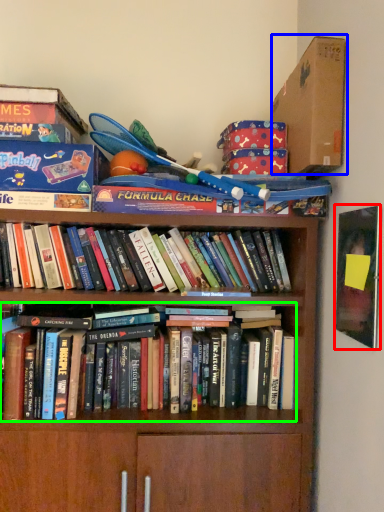
Question: Considering the real-world distances, which object is farthest from paperback book (highlighted by a red box)? cardboard box (highlighted by a blue box) or book (highlighted by a green box)?

Choices:
 (A) cardboard box
 (B) book

Answer: (B)